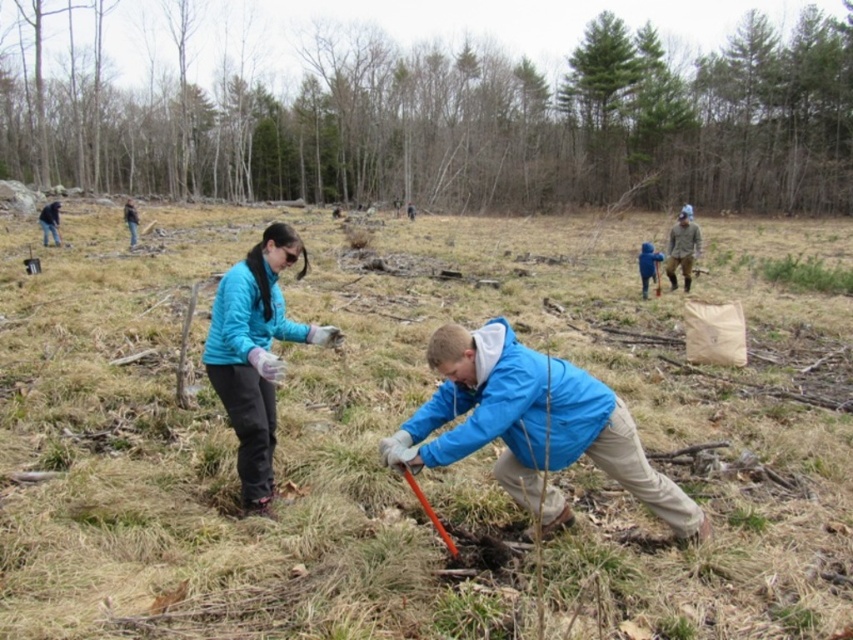
Does teal fabric jacket at lower center appear over gray woolen sweater at right?

No.

Who is shorter, teal fabric jacket at lower center or gray woolen sweater at right?

teal fabric jacket at lower center is shorter.

Locate an element on the screen. This screenshot has width=853, height=640. teal fabric jacket at lower center is located at coordinates (256, 353).

Measure the distance from gray woolen sweater at right to dark brown leather jacket at upper left.

15.22 meters

Consider the image. Is gray woolen sweater at right wider than dark brown leather jacket at upper left?

No.

Who is more forward, (683, 262) or (126, 216)?

Point (683, 262) is more forward.

Where is `gray woolen sweater at right`? gray woolen sweater at right is located at coordinates (682, 248).

I want to click on green leafy tree at upper center, so 469,125.

Between point (613, 148) and point (689, 227), which one is positioned behind?

The point (613, 148) is more distant.

Between point (364, 38) and point (682, 227), which one is positioned behind?

The point (364, 38) is more distant.

What are the coordinates of `green leafy tree at upper center` in the screenshot? It's located at (469, 125).